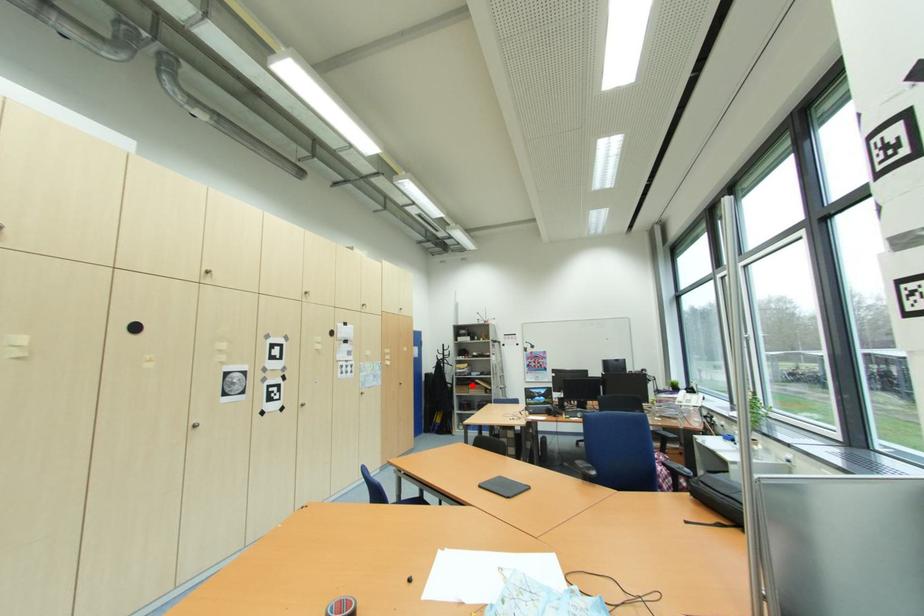
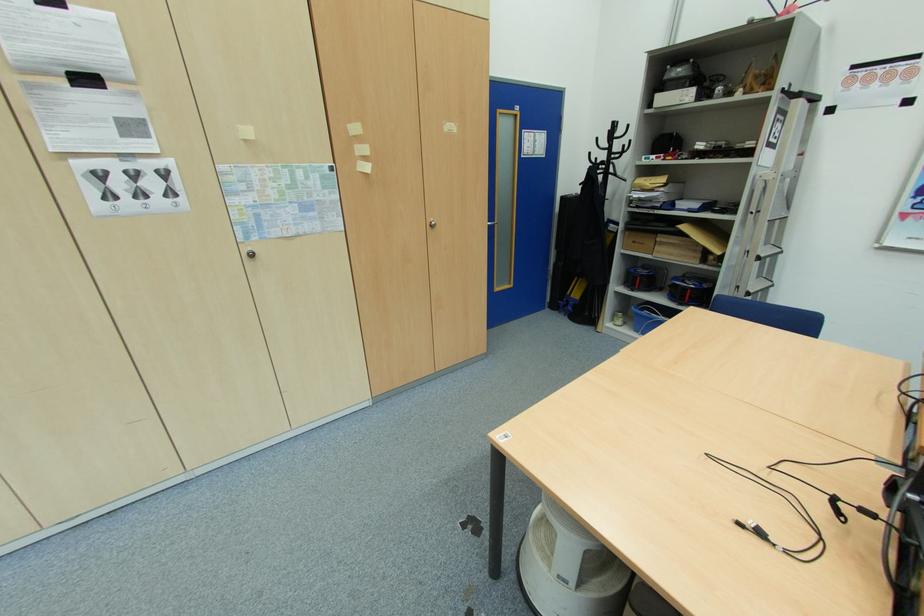
Question: I am providing you with two images of the same scene from different viewpoints. Image1 has a red point marked. In image2, the corresponding 3D location appears at what relative position? Reply with the corresponding letter.

Choices:
 (A) Closer
 (B) Farther

Answer: (A)